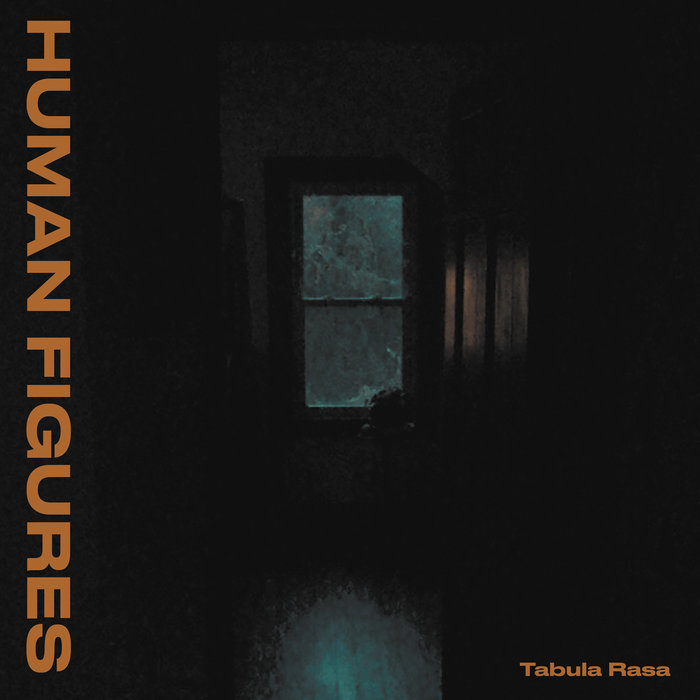
The image size is (700, 700). I want to click on table base, so click(390, 480).